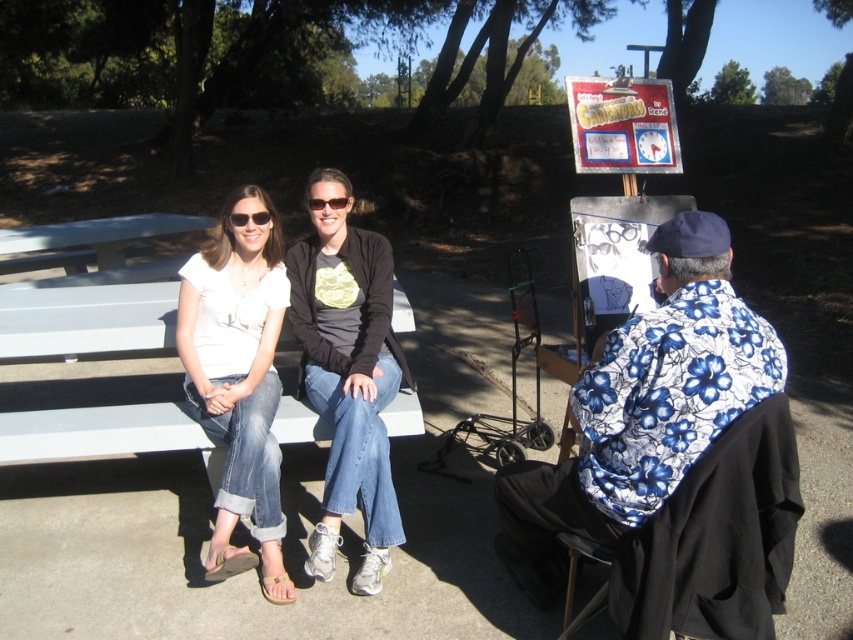
Question: Can you confirm if blue floral shirt at right is positioned to the right of denim jeans at center?

Choices:
 (A) no
 (B) yes

Answer: (B)

Question: Is blue floral shirt at right to the right of white cotton shirt at left from the viewer's perspective?

Choices:
 (A) no
 (B) yes

Answer: (B)

Question: Which object is the closest to the white cotton shirt at left?

Choices:
 (A) denim jeans at center
 (B) blue floral shirt at right

Answer: (A)

Question: Which point is closer to the camera?

Choices:
 (A) (373, 522)
 (B) (668, 280)
 (C) (189, 378)

Answer: (B)

Question: Which point is closer to the camera?

Choices:
 (A) (689, 435)
 (B) (218, 509)

Answer: (A)

Question: Is blue floral shirt at right further to camera compared to denim jeans at center?

Choices:
 (A) no
 (B) yes

Answer: (A)